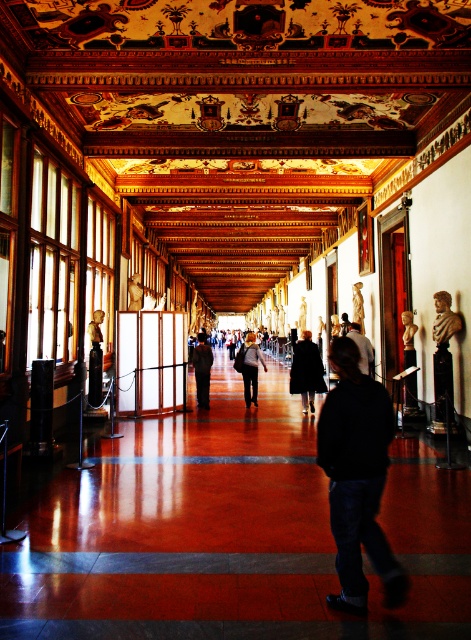
Question: Does black matte jacket at center have a smaller size compared to black coat at center?

Choices:
 (A) no
 (B) yes

Answer: (B)

Question: Does dark gray fabric coat at center have a lesser width compared to matte bronze bust at center?

Choices:
 (A) yes
 (B) no

Answer: (B)

Question: Is black matte jacket at center bigger than black coat at center?

Choices:
 (A) no
 (B) yes

Answer: (A)

Question: Which point is farther to the camera?

Choices:
 (A) (235, 355)
 (B) (349, 332)
 (C) (460, 323)

Answer: (A)

Question: Which point is closer to the camera?

Choices:
 (A) black coat at center
 (B) dark gray sweater at center
 (C) dark gray fabric coat at center
 (D) matte bronze bust at center

Answer: (B)

Question: Which of the following is the farthest from the observer?

Choices:
 (A) (294, 390)
 (B) (254, 355)
 (C) (201, 378)
 (D) (388, 593)

Answer: (B)